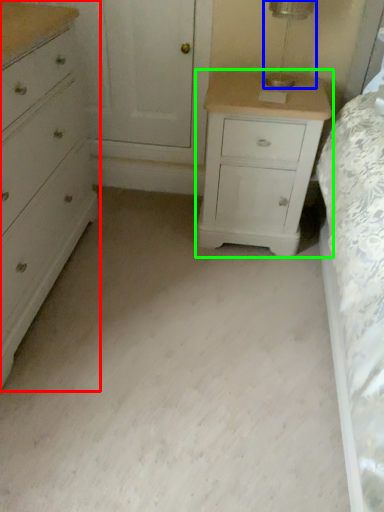
Question: Which object is the closest to the chest of drawers (highlighted by a red box)? Choose among these: table lamp (highlighted by a blue box) or nightstand (highlighted by a green box).

Choices:
 (A) table lamp
 (B) nightstand

Answer: (B)